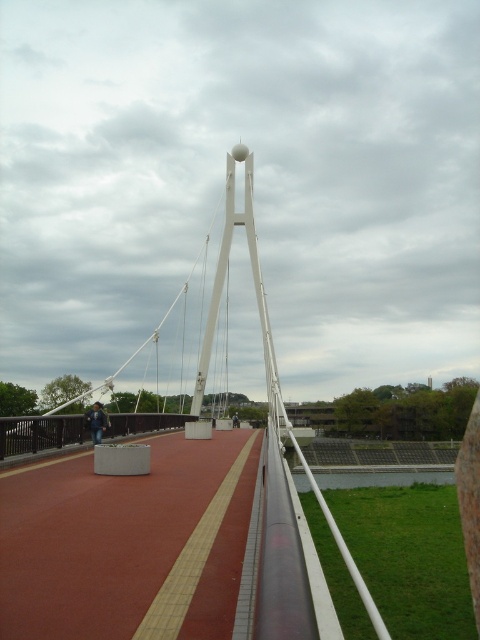
You are standing at the starting point of the bridge and want to reach the red rubber path at center. Which direction should you walk to get there?

Walk forward towards the center of the bridge to reach the red rubber path at center.

You are standing on the bridge and want to take a photo of both the white metallic suspension bridge at center and the matte gray concrete bridge at center. Which bridge should you focus on first to ensure it appears larger in your photo?

You should focus on the white metallic suspension bridge at center first because it is closer to the viewer, making it appear larger in the photo compared to the matte gray concrete bridge at center which is farther away.